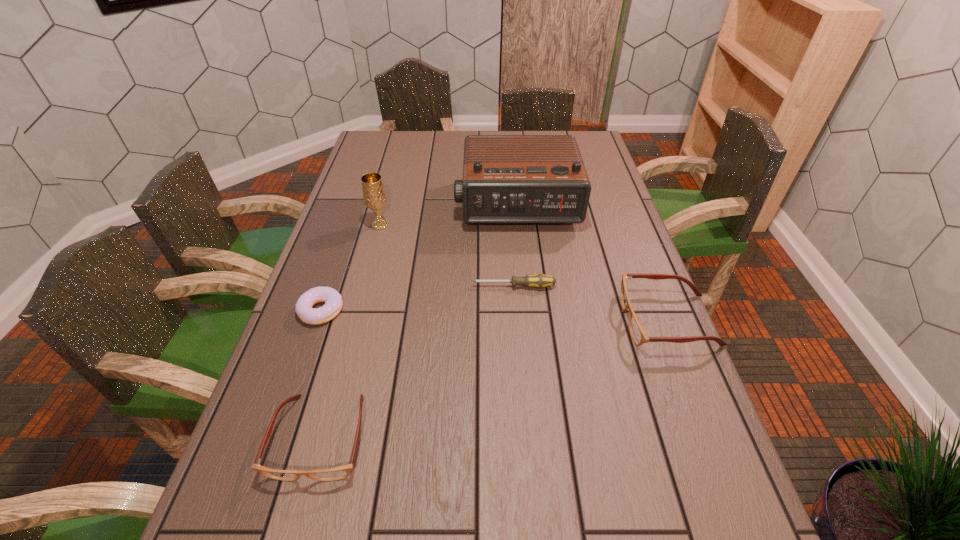
This screenshot has height=540, width=960. In order to click on free space located 0.360m on the front-facing side of the right spectacles in this screenshot , I will do `click(479, 320)`.

Where is `free space located on the back of the chalice`? free space located on the back of the chalice is located at coordinates (385, 208).

The image size is (960, 540). What are the coordinates of `vacant space located on the front panel of the tallest object` in the screenshot? It's located at (526, 302).

Where is `blank space located 0.270m on the back of the doughnut`? This screenshot has height=540, width=960. blank space located 0.270m on the back of the doughnut is located at coordinates (348, 231).

Where is `vacant area situated at the tip of the screwdriver`? vacant area situated at the tip of the screwdriver is located at coordinates (375, 286).

Identify the location of vacant space situated 0.170m at the tip of the screwdriver. pyautogui.click(x=408, y=286).

Where is `vacant region located 0.100m at the tip of the screwdriver`? The width and height of the screenshot is (960, 540). vacant region located 0.100m at the tip of the screwdriver is located at coordinates (434, 286).

I want to click on object situated at the near edge, so click(x=340, y=472).

The image size is (960, 540). In order to click on spectacles located in the left edge section of the desktop in this screenshot , I will do `click(340, 472)`.

Where is `chalice positioned at the left edge`? chalice positioned at the left edge is located at coordinates (374, 196).